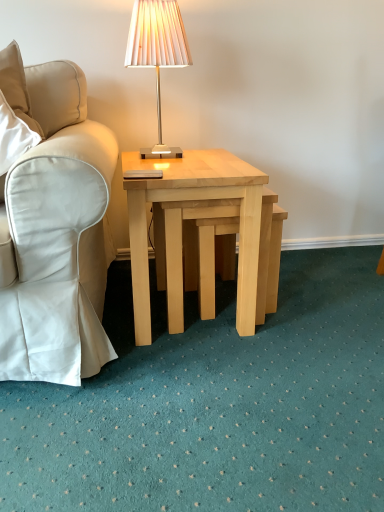
In order to click on empty space that is to the right of light wood/natural wood coffee table at center in this screenshot , I will do `click(322, 310)`.